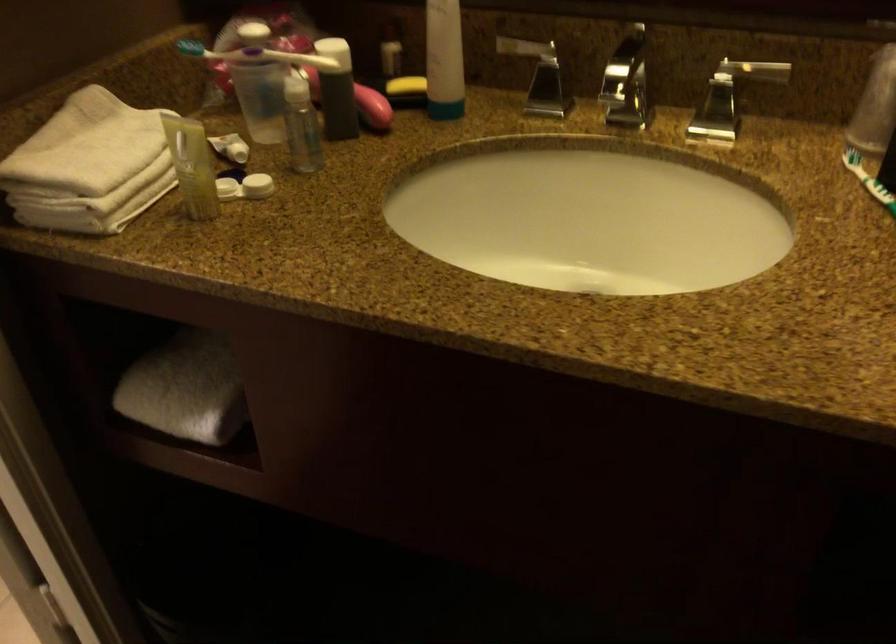
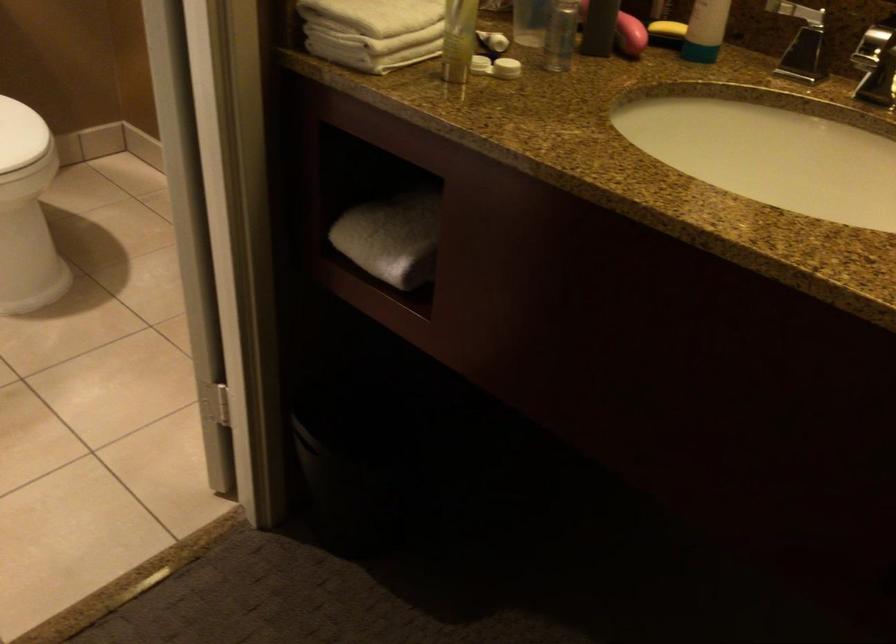
The point at (x=255, y=185) is marked in the first image. Where is the corresponding point in the second image?

(506, 68)